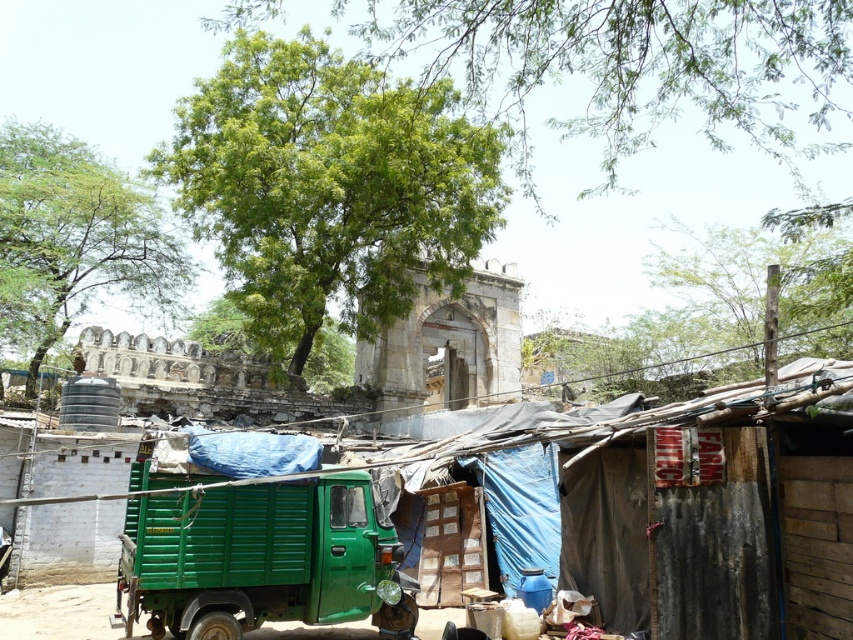
Question: Observing the image, what is the correct spatial positioning of green leafy tree at upper left in reference to green leafy tree at upper right?

Choices:
 (A) right
 (B) left

Answer: (B)

Question: Can you confirm if green leafy tree at upper center is smaller than green matte truck at center?

Choices:
 (A) no
 (B) yes

Answer: (A)

Question: Which point appears closest to the camera in this image?

Choices:
 (A) (434, 401)
 (B) (817, 260)
 (C) (102, 604)

Answer: (C)

Question: Is green leafy tree at center thinner than green matte truck at center?

Choices:
 (A) no
 (B) yes

Answer: (A)

Question: Which point appears closest to the camera in this image?

Choices:
 (A) (645, 10)
 (B) (62, 168)
 (C) (358, 195)
 (D) (3, 600)

Answer: (A)

Question: Among these points, which one is nearest to the camera?

Choices:
 (A) (363, 500)
 (B) (839, 211)
 (C) (39, 602)

Answer: (A)